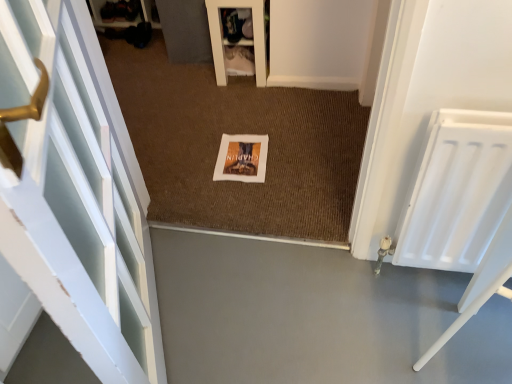
Where is `free area in between white fabric shoe rack at upper center and white matte picture frame at center`? free area in between white fabric shoe rack at upper center and white matte picture frame at center is located at coordinates (242, 110).